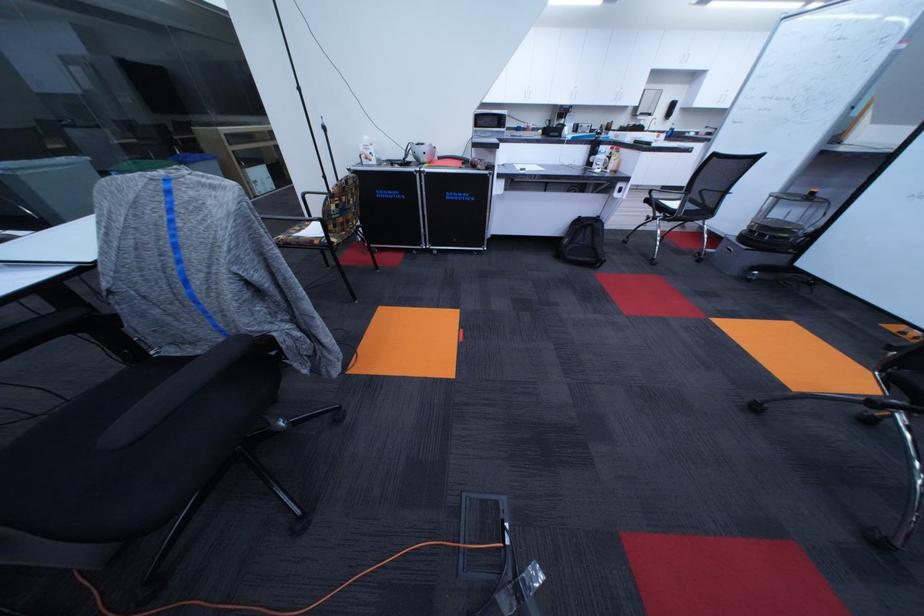
Find the location of `patterned chair sitting surface`. patterned chair sitting surface is located at coordinates (342, 208).